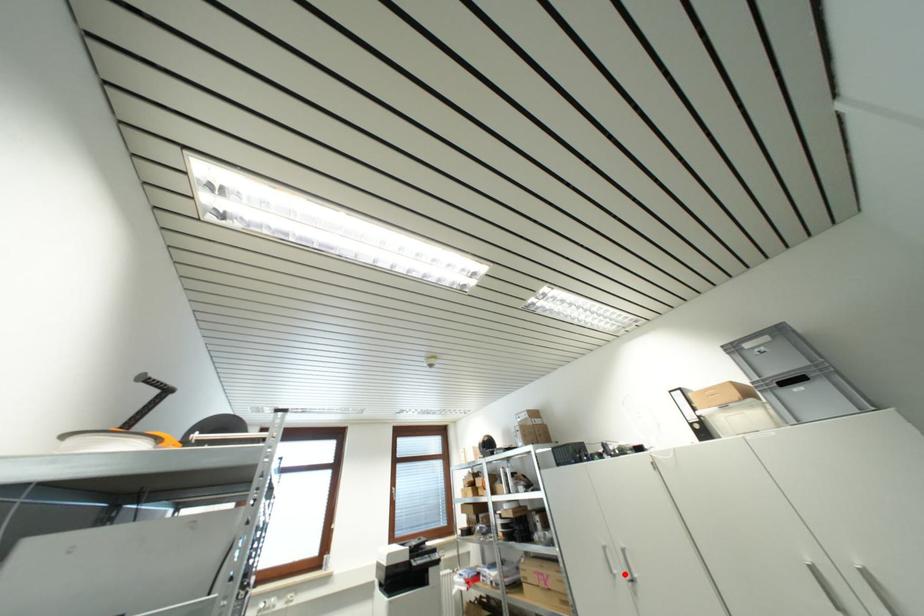
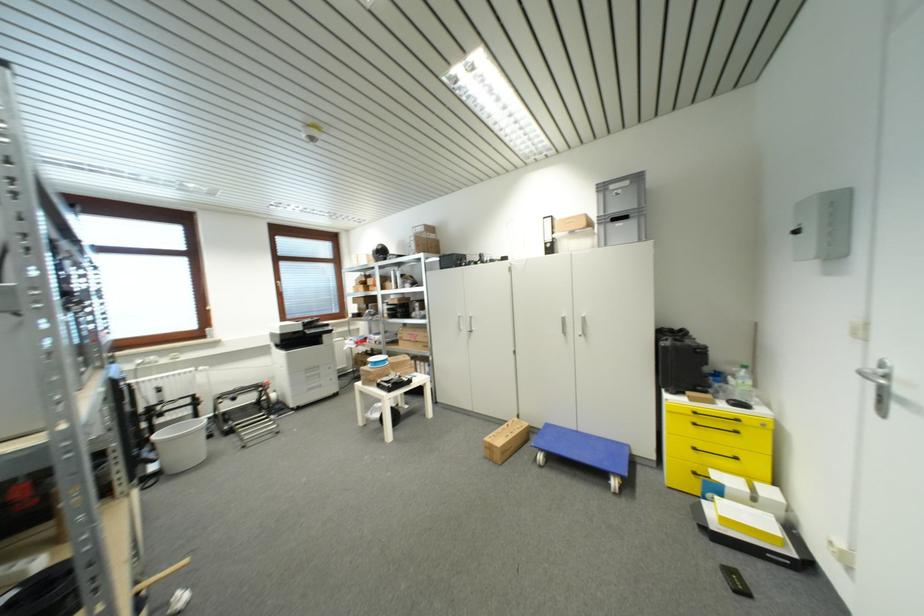
Question: I am providing you with two images of the same scene from different viewpoints. A red point is marked on the first image. Is the red point's position out of view in image 2?

Choices:
 (A) Yes
 (B) No

Answer: (B)